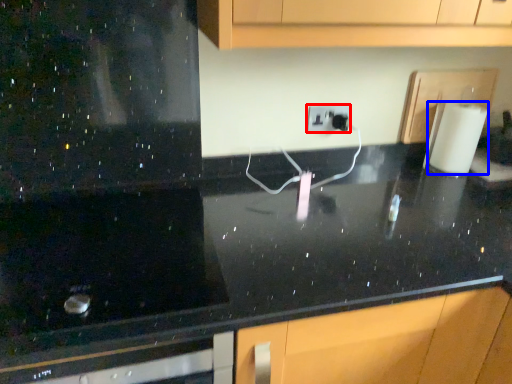
Question: Among these objects, which one is farthest to the camera, electric outlet (highlighted by a red box) or paper towel (highlighted by a blue box)?

Choices:
 (A) electric outlet
 (B) paper towel

Answer: (A)